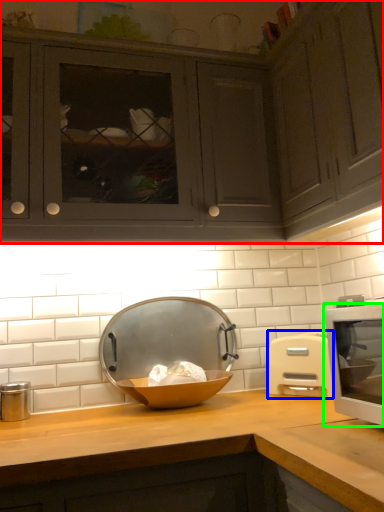
Question: Considering the real-world distances, which object is farthest from cabinetry (highlighted by a red box)? microwave oven (highlighted by a blue box) or home appliance (highlighted by a green box)?

Choices:
 (A) microwave oven
 (B) home appliance

Answer: (A)